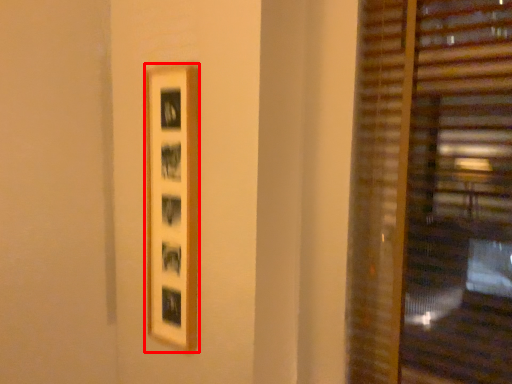
Question: From the image's perspective, where is picture frame (annotated by the red box) located relative to window blind?

Choices:
 (A) below
 (B) above

Answer: (A)